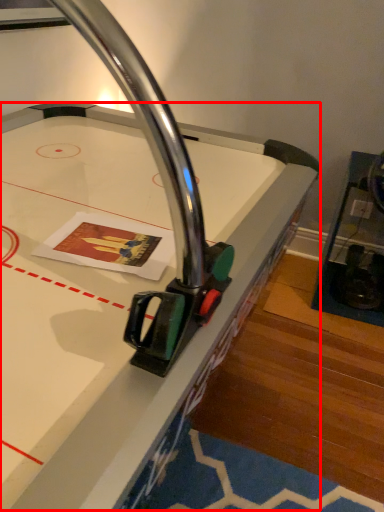
Question: Considering the relative positions of table (annotated by the red box) and furniture in the image provided, where is table (annotated by the red box) located with respect to the staircase?

Choices:
 (A) left
 (B) right

Answer: (A)